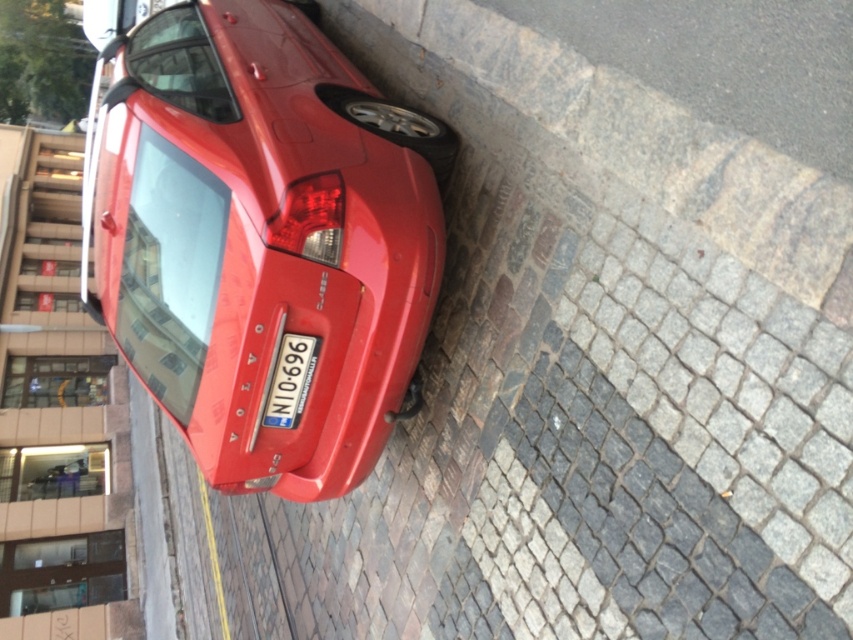
You are standing on the cobblestone street and see the glossy red car at center and the blue metallic license plate at center. Which object is positioned more to the right?

The blue metallic license plate at center is positioned more to the right than the glossy red car at center.

You are a delivery person trying to determine if the glossy red car at center will block the view of the blue metallic license plate at center from above. Based on their heights, will the license plate be visible from above the car?

The glossy red car at center has a greater height compared to blue metallic license plate at center, so the license plate may be partially or fully blocked from view above the car.